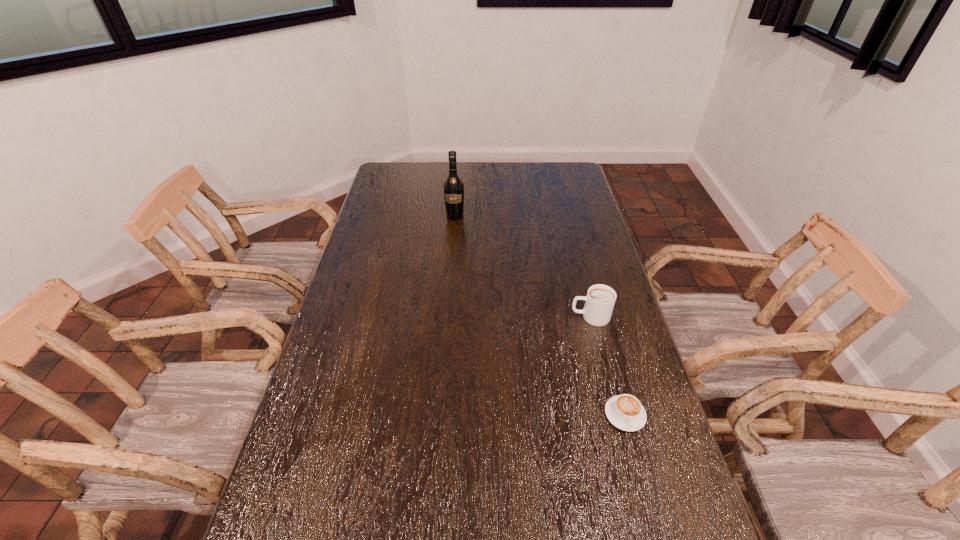
Locate an element on the screen. free space located 0.240m on the side of the nearer cappuccino with the handle is located at coordinates (659, 539).

The height and width of the screenshot is (540, 960). In the image, there is a desktop. In order to click on vacant space at the far edge in this screenshot , I will do `click(448, 164)`.

Where is `vacant space at the left edge of the desktop`? vacant space at the left edge of the desktop is located at coordinates (366, 267).

Identify the location of vacant space at the right edge of the desktop. (612, 335).

Find the location of a particular element. Image resolution: width=960 pixels, height=540 pixels. free location at the far left corner is located at coordinates (417, 166).

The height and width of the screenshot is (540, 960). I want to click on free space at the far right corner, so click(574, 171).

In order to click on free space between the tallest object and the farther cappuccino in this screenshot , I will do `click(522, 266)`.

Where is `vacant space in between the second nearest object and the nearer cappuccino`? vacant space in between the second nearest object and the nearer cappuccino is located at coordinates click(x=608, y=366).

Where is `free point between the leftmost object and the second tallest object`? free point between the leftmost object and the second tallest object is located at coordinates (522, 266).

I want to click on vacant area that lies between the shorter cappuccino and the farther cappuccino, so click(x=608, y=366).